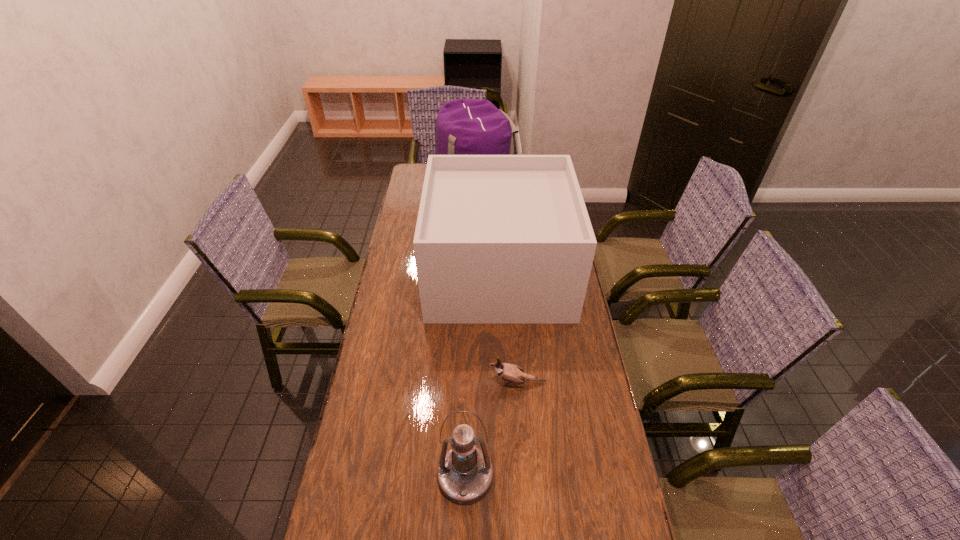
Where is `backpack`? backpack is located at coordinates (466, 126).

At what (x,y) coordinates should I click in order to perform the action: click on box. Please return your answer as a coordinate pair (x, y). This screenshot has width=960, height=540. Looking at the image, I should click on (500, 239).

Locate an element on the screen. This screenshot has height=540, width=960. oil lamp is located at coordinates (465, 473).

Where is `the second nearest object`? The height and width of the screenshot is (540, 960). the second nearest object is located at coordinates (511, 373).

The height and width of the screenshot is (540, 960). What are the coordinates of `the shortest object` in the screenshot? It's located at (511, 373).

Where is `vacant region located on the front pocket of the backpack`? vacant region located on the front pocket of the backpack is located at coordinates (542, 184).

Identify the location of vacant space located on the side of the second farthest object with the window. (404, 272).

Locate an element on the screen. This screenshot has width=960, height=540. free space located on the side of the second farthest object with the window is located at coordinates (404, 272).

Where is `vacant space positioned 0.080m on the side of the second farthest object with the window`? The width and height of the screenshot is (960, 540). vacant space positioned 0.080m on the side of the second farthest object with the window is located at coordinates (410, 272).

Where is `free space located on the back of the nearest object`? free space located on the back of the nearest object is located at coordinates (468, 398).